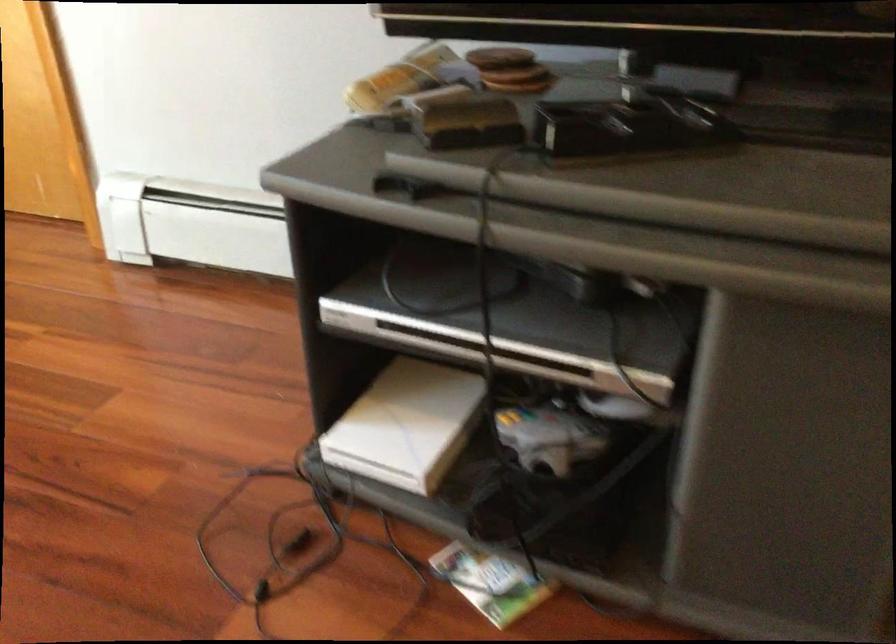
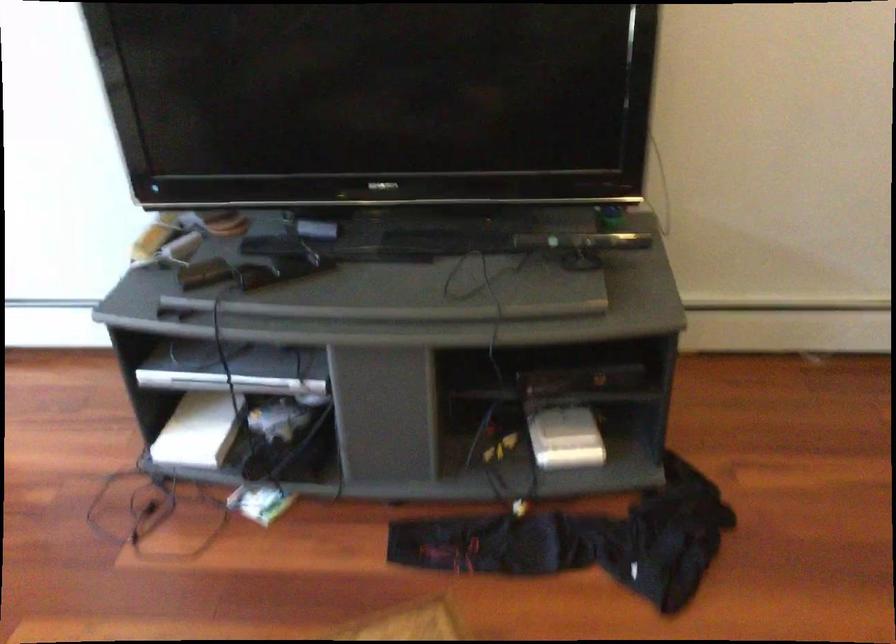
In the second image, find the point that corresponds to (478,122) in the first image.

(203, 272)